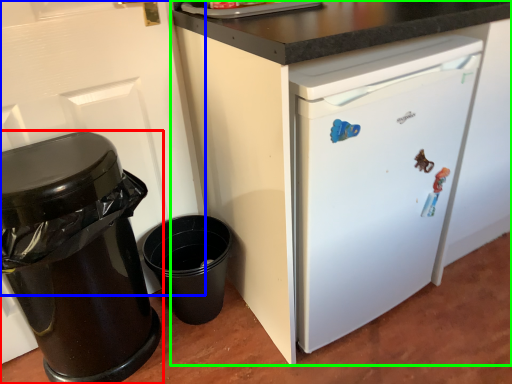
Question: Considering the real-world distances, which object is farthest from waste container (highlighted by a red box)? door (highlighted by a blue box) or cabinetry (highlighted by a green box)?

Choices:
 (A) door
 (B) cabinetry

Answer: (B)